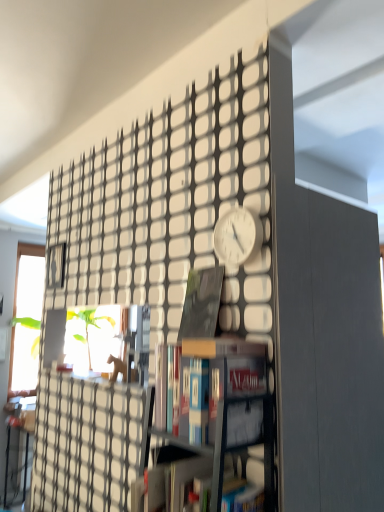
Question: Does hardcover book at center, which ranks as the 1th book in bottom-to-top order, have a greater height compared to hardcover book at center, the 2th book positioned from the top?

Choices:
 (A) yes
 (B) no

Answer: (B)

Question: Does hardcover book at center, which ranks as the 1th book in bottom-to-top order, have a greater width compared to hardcover book at center, the 2th book positioned from the top?

Choices:
 (A) yes
 (B) no

Answer: (A)

Question: Is the depth of hardcover book at center, the 3th book in the top-to-bottom sequence, less than that of hardcover book at center, marked as the second book in a bottom-to-top arrangement?

Choices:
 (A) no
 (B) yes

Answer: (B)

Question: Is hardcover book at center, the 3th book in the top-to-bottom sequence, facing towards hardcover book at center, marked as the second book in a bottom-to-top arrangement?

Choices:
 (A) yes
 (B) no

Answer: (B)

Question: Is hardcover book at center, which ranks as the 1th book in bottom-to-top order, outside hardcover book at center, the 2th book positioned from the top?

Choices:
 (A) no
 (B) yes

Answer: (B)

Question: Is hardcover book at center, the 3th book in the top-to-bottom sequence, wider or thinner than hardcover book at center, marked as the second book in a bottom-to-top arrangement?

Choices:
 (A) thin
 (B) wide

Answer: (B)

Question: In terms of size, does hardcover book at center, the 3th book in the top-to-bottom sequence, appear bigger or smaller than hardcover book at center, the 2th book positioned from the top?

Choices:
 (A) big
 (B) small

Answer: (A)

Question: In the image, is hardcover book at center, which ranks as the 1th book in bottom-to-top order, on the left side or the right side of hardcover book at center, marked as the second book in a bottom-to-top arrangement?

Choices:
 (A) left
 (B) right

Answer: (A)

Question: From a real-world perspective, is hardcover book at center, the 3th book in the top-to-bottom sequence, above or below hardcover book at center, the 2th book positioned from the top?

Choices:
 (A) below
 (B) above

Answer: (A)

Question: Considering the relative positions of hardcover book at center, marked as the second book in a bottom-to-top arrangement, and hardcover book at center, the 3th book in the top-to-bottom sequence, in the image provided, is hardcover book at center, marked as the second book in a bottom-to-top arrangement, to the left or to the right of hardcover book at center, the 3th book in the top-to-bottom sequence,?

Choices:
 (A) left
 (B) right

Answer: (B)

Question: Considering the positions of hardcover book at center, the 2th book positioned from the top, and hardcover book at center, which ranks as the 1th book in bottom-to-top order, in the image, is hardcover book at center, the 2th book positioned from the top, taller or shorter than hardcover book at center, which ranks as the 1th book in bottom-to-top order,?

Choices:
 (A) tall
 (B) short

Answer: (A)

Question: Considering the positions of hardcover book at center, the 2th book positioned from the top, and hardcover book at center, which ranks as the 1th book in bottom-to-top order, in the image, is hardcover book at center, the 2th book positioned from the top, bigger or smaller than hardcover book at center, which ranks as the 1th book in bottom-to-top order,?

Choices:
 (A) big
 (B) small

Answer: (B)

Question: In the image, is hardcover book at center, the 2th book positioned from the top, positioned in front of or behind hardcover book at center, the 3th book in the top-to-bottom sequence?

Choices:
 (A) behind
 (B) front

Answer: (A)

Question: In terms of width, does hardcover book at center, which ranks as the 1th book in bottom-to-top order, look wider or thinner when compared to matte black book at center, the 3th book in the bottom-to-top sequence?

Choices:
 (A) thin
 (B) wide

Answer: (B)

Question: Considering the relative positions of hardcover book at center, the 3th book in the top-to-bottom sequence, and matte black book at center, the 3th book in the bottom-to-top sequence, in the image provided, is hardcover book at center, the 3th book in the top-to-bottom sequence, to the left or to the right of matte black book at center, the 3th book in the bottom-to-top sequence,?

Choices:
 (A) right
 (B) left

Answer: (B)